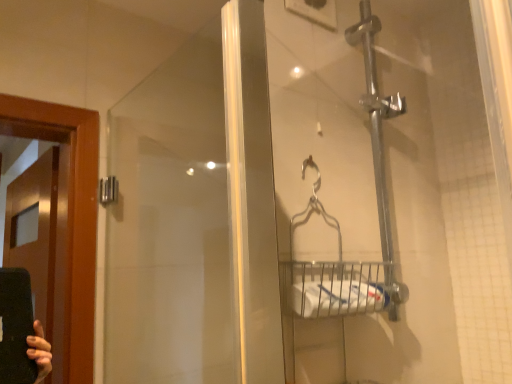
Measure the distance between point (255, 53) and camera.

Point (255, 53) is 1.51 meters away from camera.

The width and height of the screenshot is (512, 384). Describe the element at coordinates (196, 216) in the screenshot. I see `transparent glass screen door at center` at that location.

At what (x,y) coordinates should I click in order to perform the action: click on transparent glass screen door at center. Please return your answer as a coordinate pair (x, y). This screenshot has height=384, width=512. Looking at the image, I should click on (196, 216).

You are a GUI agent. You are given a task and a screenshot of the screen. Output one action in this format:
    pyautogui.click(x=<x>, y=<y>)
    Task: Click on the transparent glass screen door at center
    
    Given the screenshot: What is the action you would take?
    (x=196, y=216)